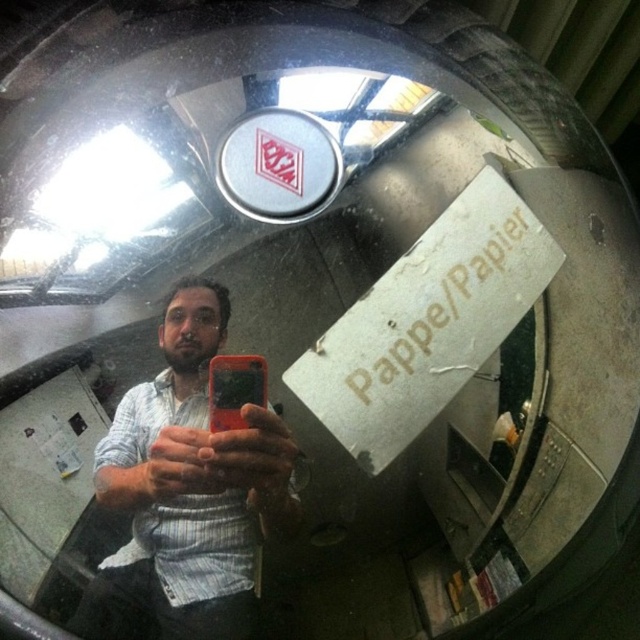
You are a photographer trying to capture the scene from the same angle. The subject is holding an orange matte smartphone at center, and wearing a white striped shirt at center. Which object is closer to the camera in this fisheye perspective?

The orange matte smartphone at center is closer to the camera because the white striped shirt at center is positioned under it, indicating the smartphone is above and thus nearer in the fisheye perspective.

You are a photographer trying to capture a clear shot of the white striped shirt at center and the orange matte smartphone at center. Based on their sizes in the image, which object should you focus on first to ensure both are in frame?

The white striped shirt at center might be wider than orange matte smartphone at center, so you should focus on the white striped shirt at center first to ensure it fits within the frame.

You are a photographer trying to capture a clear photo of the white striped shirt at center and the orange matte smartphone at center. Since the scene is taken with a fisheye lens, which object might appear more distorted due to its size and position?

The white striped shirt at center is larger in size than the orange matte smartphone at center, so it might appear more distorted in the fisheye lens photo because larger objects closer to the lens typically experience more distortion.